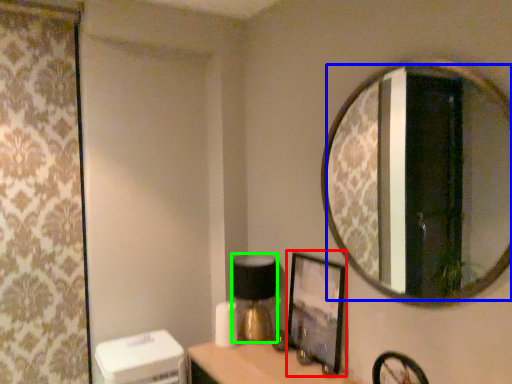
Question: Which is farther away from picture frame (highlighted by a red box)? mirror (highlighted by a blue box) or table lamp (highlighted by a green box)?

Choices:
 (A) mirror
 (B) table lamp

Answer: (A)